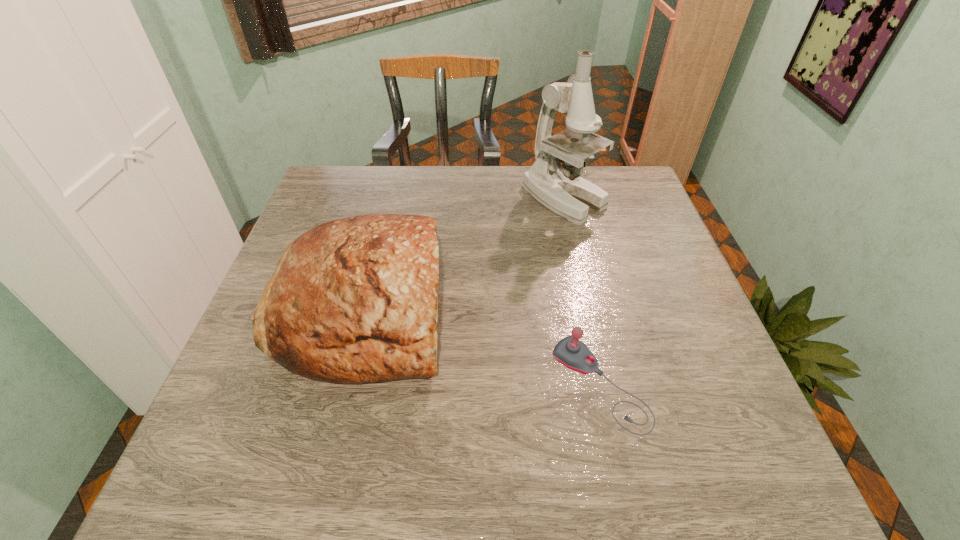
Find the location of a particular element. microscope is located at coordinates (560, 188).

Identify the location of the farthest object. The width and height of the screenshot is (960, 540). (560, 188).

The width and height of the screenshot is (960, 540). Find the location of `the second shortest object`. the second shortest object is located at coordinates (355, 300).

In order to click on bread in this screenshot , I will do `click(355, 300)`.

Find the location of a particular element. joystick is located at coordinates click(x=572, y=353).

The width and height of the screenshot is (960, 540). In order to click on free spot located on the front of the microscope in this screenshot , I will do `click(575, 248)`.

At what (x,y) coordinates should I click in order to perform the action: click on vacant position located 0.120m at the sliced front of the bread. Please return your answer as a coordinate pair (x, y). Looking at the image, I should click on (501, 308).

Where is `vacant space situated 0.070m on the front of the shortest object`? Image resolution: width=960 pixels, height=540 pixels. vacant space situated 0.070m on the front of the shortest object is located at coordinates (620, 478).

Find the location of `object that is at the far edge`. object that is at the far edge is located at coordinates (560, 188).

You are a GUI agent. You are given a task and a screenshot of the screen. Output one action in this format:
    pyautogui.click(x=<x>, y=<y>)
    Task: Click on the object that is at the left edge
    This screenshot has width=960, height=540.
    Given the screenshot: What is the action you would take?
    pyautogui.click(x=355, y=300)